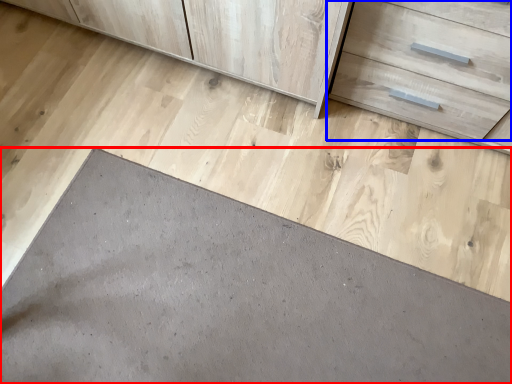
Question: Which of the following is the farthest to the observer, slate (highlighted by a red box) or drawer (highlighted by a blue box)?

Choices:
 (A) slate
 (B) drawer

Answer: (A)